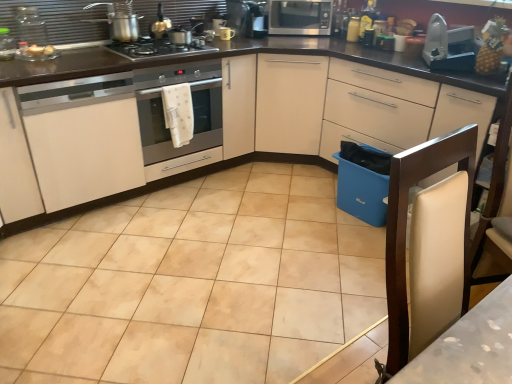
You are a GUI agent. You are given a task and a screenshot of the screen. Output one action in this format:
    pyautogui.click(x=<x>, y=<y>)
    Task: Click on the space that is in front of metallic silver toaster at upper center, acting as the 3th appliance starting from the left
    This screenshot has width=512, height=384.
    Given the screenshot: What is the action you would take?
    pyautogui.click(x=223, y=43)